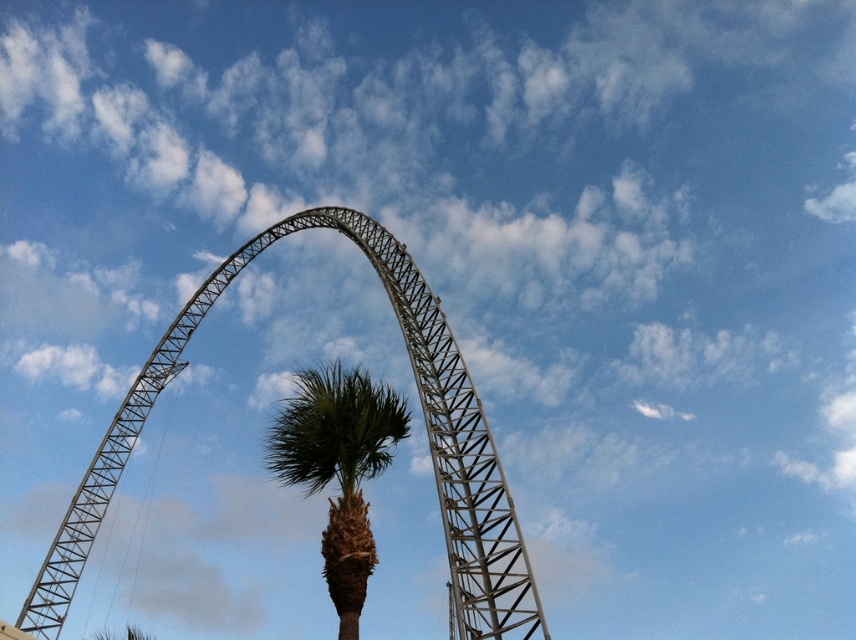
You are a park visitor standing at the entrance of the roller coaster area. You see the metallic structure at center and the green leafy palm tree at center. Which object is positioned higher relative to the other?

The metallic structure at center is located above the green leafy palm tree at center, so it is positioned higher.

You are a maintenance worker needing to inspect both the metallic structure at center and the green leafy palm tree at center. Given that you can walk at 1.5 meters per second, how long will it take you to walk from one to the other?

The distance between the metallic structure at center and the green leafy palm tree at center is 17.08 meters. At a walking speed of 1.5 meters per second, it would take approximately 11.39 seconds to walk between them.

You are a visitor at the amusement park and want to take a photo of the metallic structure at center and the green leafy palm tree at center. Which object should you focus on first if you want to capture both in the frame without moving the camera?

The metallic structure at center is wider than the green leafy palm tree at center, so you should focus on the metallic structure at center first to ensure it fits entirely within the frame.